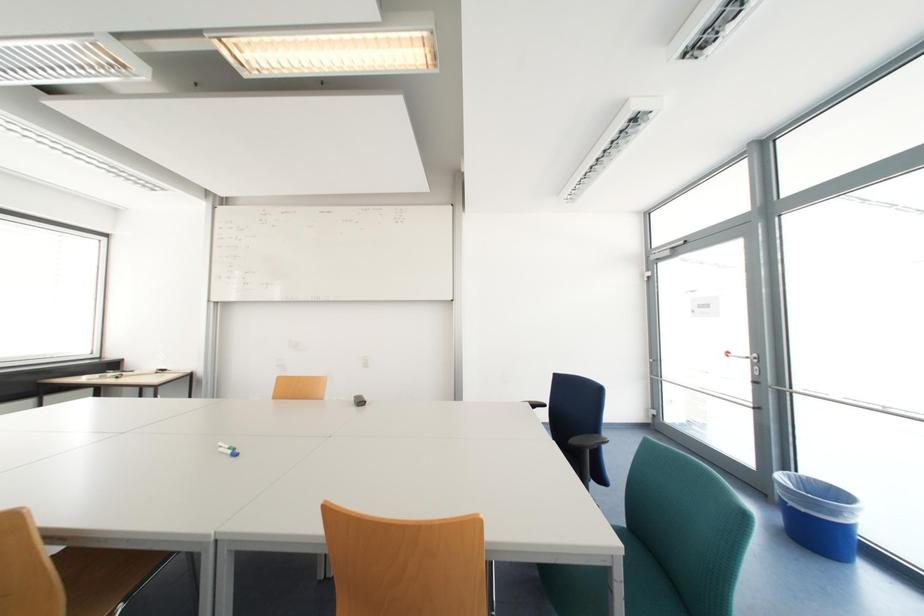
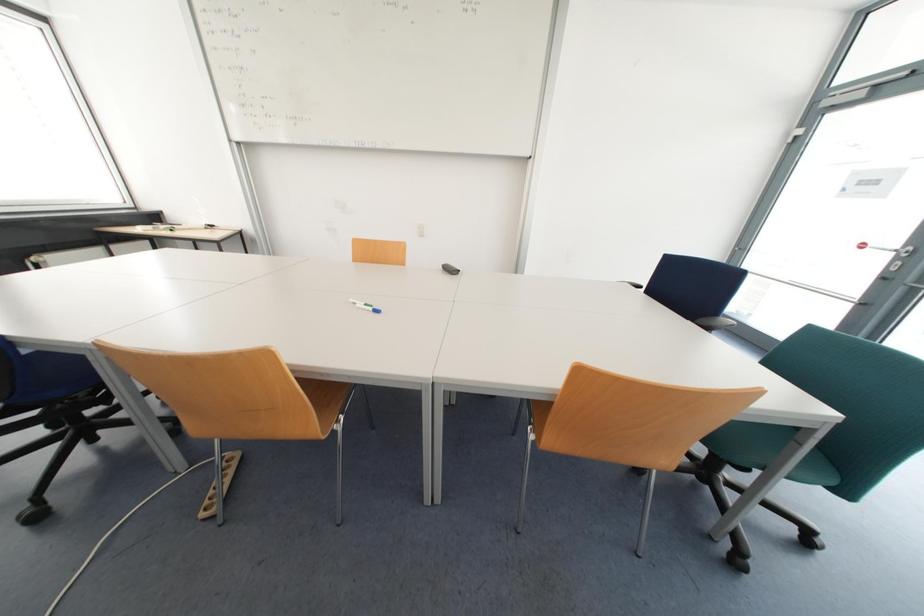
Question: The images are taken continuously from a first-person perspective. In which direction is your viewpoint rotating?

Choices:
 (A) Left
 (B) Right
 (C) Up
 (D) Down

Answer: (D)